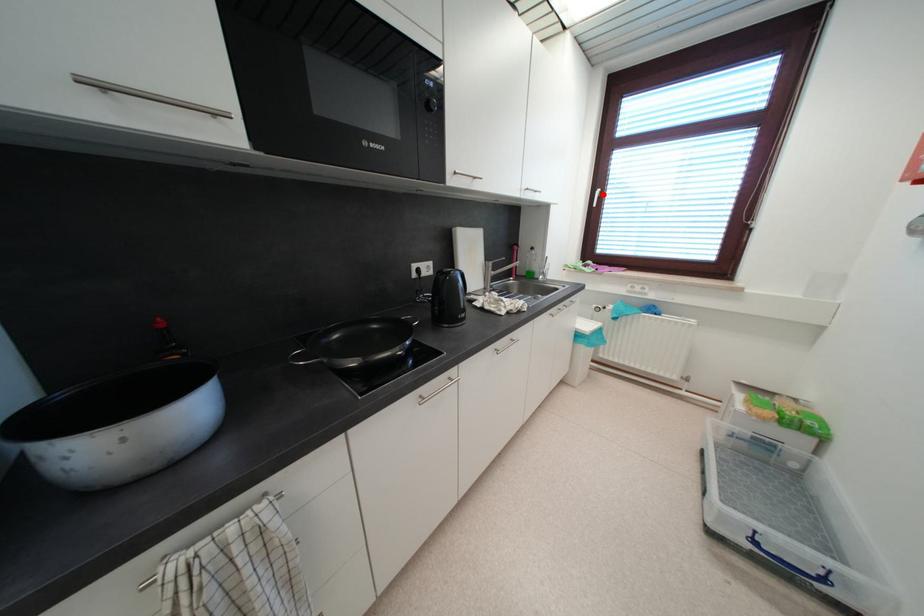
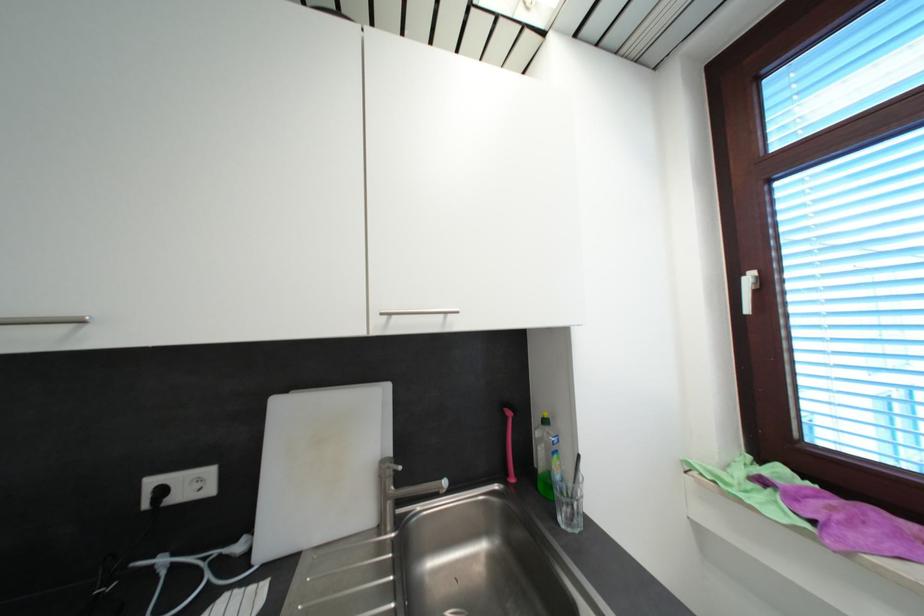
Locate, in the second image, the point that corresponds to the highlighted location in the first image.

(754, 281)